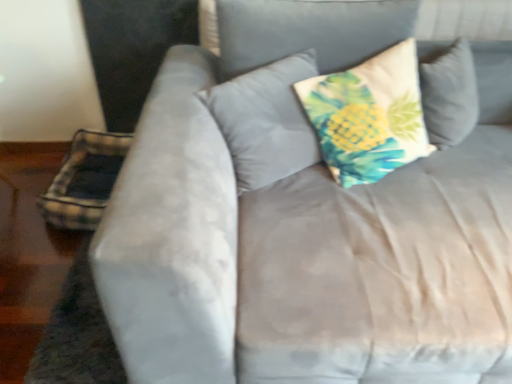
In order to face plaid fabric pillow at lower left, which is counted as the 3th pillow, starting from the right, should I rotate leftwards or rightwards?

It's best to rotate left around 21.419 degrees.

In order to face printed fabric pillow at center, the 2th pillow from the left, should I rotate leftwards or rightwards?

Rotate right and turn 2.110 degrees.

Describe the element at coordinates (368, 116) in the screenshot. The height and width of the screenshot is (384, 512). I see `printed fabric pillow at center, which ranks as the third pillow in left-to-right order` at that location.

This screenshot has height=384, width=512. Find the location of `plaid fabric pillow at lower left, the 1th pillow in the left-to-right sequence`. plaid fabric pillow at lower left, the 1th pillow in the left-to-right sequence is located at coordinates (85, 180).

From the image's perspective, which object appears higher, plaid fabric pillow at lower left, which is counted as the 3th pillow, starting from the right, or printed fabric pillow at center, which is the 1th pillow from right to left?

printed fabric pillow at center, which is the 1th pillow from right to left, from the image's perspective.

Based on the photo, is plaid fabric pillow at lower left, the 1th pillow in the left-to-right sequence, wider than printed fabric pillow at center, which is the 1th pillow from right to left?

Indeed, plaid fabric pillow at lower left, the 1th pillow in the left-to-right sequence, has a greater width compared to printed fabric pillow at center, which is the 1th pillow from right to left.

Which object is further away from the camera, plaid fabric pillow at lower left, the 1th pillow in the left-to-right sequence, or printed fabric pillow at center, which ranks as the third pillow in left-to-right order?

plaid fabric pillow at lower left, the 1th pillow in the left-to-right sequence, is behind.

Looking at this image, considering the relative sizes of printed fabric pillow at center, which ranks as the third pillow in left-to-right order, and printed fabric pillow at center, the 2th pillow from the left, in the image provided, is printed fabric pillow at center, which ranks as the third pillow in left-to-right order, smaller than printed fabric pillow at center, the 2th pillow from the left,?

Incorrect, printed fabric pillow at center, which ranks as the third pillow in left-to-right order, is not smaller in size than printed fabric pillow at center, the 2th pillow from the left.

Considering the points (403, 60) and (269, 78), which point is behind, point (403, 60) or point (269, 78)?

Positioned behind is point (403, 60).

In the scene shown: From a real-world perspective, does printed fabric pillow at center, which is the 1th pillow from right to left, stand above printed fabric pillow at center, the 2th pillow from the left?

Indeed, from a real-world perspective, printed fabric pillow at center, which is the 1th pillow from right to left, stands above printed fabric pillow at center, the 2th pillow from the left.

In the scene shown: Does printed fabric pillow at center, which ranks as the third pillow in left-to-right order, have a lesser width compared to printed fabric pillow at center, the second pillow from the right?

In fact, printed fabric pillow at center, which ranks as the third pillow in left-to-right order, might be wider than printed fabric pillow at center, the second pillow from the right.

What's the angular difference between printed fabric pillow at center, the 2th pillow from the left, and printed fabric pillow at center, which is the 1th pillow from right to left,'s facing directions?

They differ by 0.000405 degrees in their facing directions.

From a real-world perspective, is printed fabric pillow at center, the second pillow from the right, above or below printed fabric pillow at center, which ranks as the third pillow in left-to-right order?

Clearly, from a real-world perspective, printed fabric pillow at center, the second pillow from the right, is below printed fabric pillow at center, which ranks as the third pillow in left-to-right order.

Is printed fabric pillow at center, the 2th pillow from the left, in front of or behind printed fabric pillow at center, which ranks as the third pillow in left-to-right order, in the image?

printed fabric pillow at center, the 2th pillow from the left, is positioned farther from the viewer than printed fabric pillow at center, which ranks as the third pillow in left-to-right order.

Image resolution: width=512 pixels, height=384 pixels. Identify the location of pillow that is the 1st one below the printed fabric pillow at center, which ranks as the third pillow in left-to-right order (from a real-world perspective). (266, 121).

From the image's perspective, between printed fabric pillow at center, the second pillow from the right, and plaid fabric pillow at lower left, which is counted as the 3th pillow, starting from the right, which one is located above?

printed fabric pillow at center, the second pillow from the right, from the image's perspective.

Is the surface of printed fabric pillow at center, the 2th pillow from the left, in direct contact with plaid fabric pillow at lower left, the 1th pillow in the left-to-right sequence?

No, printed fabric pillow at center, the 2th pillow from the left, is not touching plaid fabric pillow at lower left, the 1th pillow in the left-to-right sequence.

From their relative heights in the image, would you say printed fabric pillow at center, the second pillow from the right, is taller or shorter than plaid fabric pillow at lower left, which is counted as the 3th pillow, starting from the right?

printed fabric pillow at center, the second pillow from the right, is taller than plaid fabric pillow at lower left, which is counted as the 3th pillow, starting from the right.

Is printed fabric pillow at center, the second pillow from the right, turned away from plaid fabric pillow at lower left, the 1th pillow in the left-to-right sequence?

No, printed fabric pillow at center, the second pillow from the right,'s orientation is not away from plaid fabric pillow at lower left, the 1th pillow in the left-to-right sequence.

Which object is wider, printed fabric pillow at center, which is the 1th pillow from right to left, or plaid fabric pillow at lower left, which is counted as the 3th pillow, starting from the right?

plaid fabric pillow at lower left, which is counted as the 3th pillow, starting from the right.

Is printed fabric pillow at center, which ranks as the third pillow in left-to-right order, taller than plaid fabric pillow at lower left, the 1th pillow in the left-to-right sequence?

Correct, printed fabric pillow at center, which ranks as the third pillow in left-to-right order, is much taller as plaid fabric pillow at lower left, the 1th pillow in the left-to-right sequence.

From the image's perspective, which is above, printed fabric pillow at center, which is the 1th pillow from right to left, or plaid fabric pillow at lower left, the 1th pillow in the left-to-right sequence?

From the image's view, printed fabric pillow at center, which is the 1th pillow from right to left, is above.

Considering the relative positions of printed fabric pillow at center, which is the 1th pillow from right to left, and plaid fabric pillow at lower left, which is counted as the 3th pillow, starting from the right, in the image provided, is printed fabric pillow at center, which is the 1th pillow from right to left, to the right of plaid fabric pillow at lower left, which is counted as the 3th pillow, starting from the right, from the viewer's perspective?

Correct, you'll find printed fabric pillow at center, which is the 1th pillow from right to left, to the right of plaid fabric pillow at lower left, which is counted as the 3th pillow, starting from the right.

Measure the distance between plaid fabric pillow at lower left, which is counted as the 3th pillow, starting from the right, and printed fabric pillow at center, the second pillow from the right.

plaid fabric pillow at lower left, which is counted as the 3th pillow, starting from the right, and printed fabric pillow at center, the second pillow from the right, are 35.99 inches apart from each other.

Does plaid fabric pillow at lower left, which is counted as the 3th pillow, starting from the right, have a lesser height compared to printed fabric pillow at center, the second pillow from the right?

Indeed, plaid fabric pillow at lower left, which is counted as the 3th pillow, starting from the right, has a lesser height compared to printed fabric pillow at center, the second pillow from the right.

Considering the sizes of objects plaid fabric pillow at lower left, which is counted as the 3th pillow, starting from the right, and printed fabric pillow at center, the second pillow from the right, in the image provided, who is bigger, plaid fabric pillow at lower left, which is counted as the 3th pillow, starting from the right, or printed fabric pillow at center, the second pillow from the right,?

plaid fabric pillow at lower left, which is counted as the 3th pillow, starting from the right.

Can you confirm if plaid fabric pillow at lower left, the 1th pillow in the left-to-right sequence, is positioned to the left of printed fabric pillow at center, the second pillow from the right?

Indeed, plaid fabric pillow at lower left, the 1th pillow in the left-to-right sequence, is positioned on the left side of printed fabric pillow at center, the second pillow from the right.

From the image's perspective, starting from the plaid fabric pillow at lower left, which is counted as the 3th pillow, starting from the right, which pillow is the 1st one above? Please provide its 2D coordinates.

[(368, 116)]

Image resolution: width=512 pixels, height=384 pixels. I want to click on pillow on the right side of printed fabric pillow at center, the second pillow from the right, so click(368, 116).

From the picture: Estimate the real-world distances between objects in this image. Which object is further from printed fabric pillow at center, which is the 1th pillow from right to left, printed fabric pillow at center, the 2th pillow from the left, or plaid fabric pillow at lower left, the 1th pillow in the left-to-right sequence?

plaid fabric pillow at lower left, the 1th pillow in the left-to-right sequence, lies further to printed fabric pillow at center, which is the 1th pillow from right to left, than the other object.

Considering their positions, is plaid fabric pillow at lower left, which is counted as the 3th pillow, starting from the right, positioned closer to printed fabric pillow at center, the second pillow from the right, than printed fabric pillow at center, which ranks as the third pillow in left-to-right order?

Among the two, printed fabric pillow at center, which ranks as the third pillow in left-to-right order, is located nearer to printed fabric pillow at center, the second pillow from the right.

From the image, which object appears to be farther from plaid fabric pillow at lower left, the 1th pillow in the left-to-right sequence, printed fabric pillow at center, which ranks as the third pillow in left-to-right order, or printed fabric pillow at center, the second pillow from the right?

Among the two, printed fabric pillow at center, which ranks as the third pillow in left-to-right order, is located further to plaid fabric pillow at lower left, the 1th pillow in the left-to-right sequence.

Looking at the image, which one is located further to printed fabric pillow at center, the 2th pillow from the left, printed fabric pillow at center, which is the 1th pillow from right to left, or plaid fabric pillow at lower left, which is counted as the 3th pillow, starting from the right?

plaid fabric pillow at lower left, which is counted as the 3th pillow, starting from the right.

Based on their spatial positions, is printed fabric pillow at center, the second pillow from the right, or printed fabric pillow at center, which is the 1th pillow from right to left, further from plaid fabric pillow at lower left, which is counted as the 3th pillow, starting from the right?

Among the two, printed fabric pillow at center, which is the 1th pillow from right to left, is located further to plaid fabric pillow at lower left, which is counted as the 3th pillow, starting from the right.

Looking at this image, from the image, which object appears to be nearer to printed fabric pillow at center, which ranks as the third pillow in left-to-right order, plaid fabric pillow at lower left, which is counted as the 3th pillow, starting from the right, or printed fabric pillow at center, the 2th pillow from the left?

Based on the image, printed fabric pillow at center, the 2th pillow from the left, appears to be nearer to printed fabric pillow at center, which ranks as the third pillow in left-to-right order.

This screenshot has width=512, height=384. Find the location of `pillow between plaid fabric pillow at lower left, the 1th pillow in the left-to-right sequence, and printed fabric pillow at center, which is the 1th pillow from right to left, in the horizontal direction`. pillow between plaid fabric pillow at lower left, the 1th pillow in the left-to-right sequence, and printed fabric pillow at center, which is the 1th pillow from right to left, in the horizontal direction is located at coordinates (266, 121).